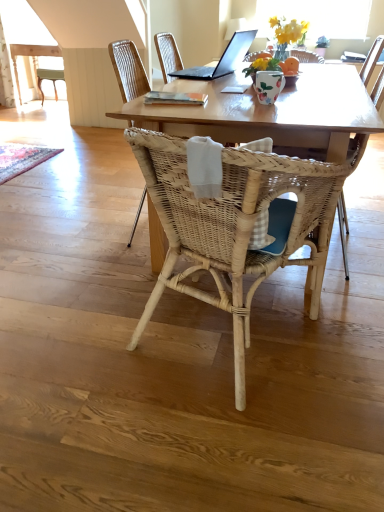
Locate an element on the screen. This screenshot has width=384, height=512. vacant area that lies between woven wood chair at center, positioned as the first chair in front-to-back order, and natural wood table at center is located at coordinates (202, 317).